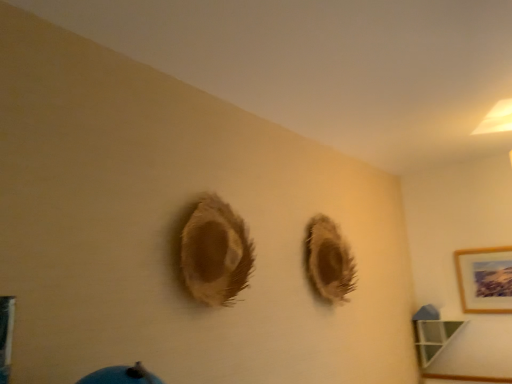
What do you see at coordinates (329, 261) in the screenshot? I see `fuzzy brown hole at center` at bounding box center [329, 261].

Find the location of a particular element. fuzzy brown hole at center is located at coordinates (329, 261).

What is the approximate height of wooden picture frame at upper right?

wooden picture frame at upper right is 17.20 inches in height.

Where is `fuzzy brown hole at center`? fuzzy brown hole at center is located at coordinates (329, 261).

From the image's perspective, between green glass shelf at lower right and fuzzy brown hole at center, which one is located above?

fuzzy brown hole at center.

From the picture: Which is more to the left, green glass shelf at lower right or fuzzy brown hole at center?

fuzzy brown hole at center.

How different are the orientations of green glass shelf at lower right and fuzzy brown hole at center in degrees?

The facing directions of green glass shelf at lower right and fuzzy brown hole at center are 87.4 degrees apart.

Is green glass shelf at lower right oriented towards fuzzy brown hole at center?

Yes, green glass shelf at lower right is facing fuzzy brown hole at center.

From the image's perspective, who appears lower, fuzzy brown hole at center or green glass shelf at lower right?

green glass shelf at lower right appears lower in the image.

Is fuzzy brown hole at center taller or shorter than green glass shelf at lower right?

In the image, fuzzy brown hole at center appears to be taller than green glass shelf at lower right.

Which is correct: fuzzy brown hole at center is inside green glass shelf at lower right, or outside of it?

fuzzy brown hole at center is outside green glass shelf at lower right.

From a real-world perspective, who is located higher, fuzzy brown hole at center or green glass shelf at lower right?

fuzzy brown hole at center.

Is green glass shelf at lower right facing towards wooden picture frame at upper right?

No, green glass shelf at lower right is not oriented towards wooden picture frame at upper right.

The height and width of the screenshot is (384, 512). I want to click on shelf behind the wooden picture frame at upper right, so click(x=433, y=338).

Is green glass shelf at lower right thinner than wooden picture frame at upper right?

Incorrect, the width of green glass shelf at lower right is not less than that of wooden picture frame at upper right.

Who is taller, green glass shelf at lower right or wooden picture frame at upper right?

wooden picture frame at upper right.

Where is `picture frame above the green glass shelf at lower right (from the image's perspective)`? This screenshot has width=512, height=384. picture frame above the green glass shelf at lower right (from the image's perspective) is located at coordinates (485, 280).

From a real-world perspective, relative to green glass shelf at lower right, is wooden picture frame at upper right vertically above or below?

wooden picture frame at upper right is situated higher than green glass shelf at lower right in the real world.

Which object is further away from the camera, wooden picture frame at upper right or green glass shelf at lower right?

Positioned behind is green glass shelf at lower right.

From the image's perspective, who appears lower, wooden picture frame at upper right or green glass shelf at lower right?

green glass shelf at lower right, from the image's perspective.

Is wooden picture frame at upper right not within fuzzy brown hole at center?

That's correct, wooden picture frame at upper right is outside of fuzzy brown hole at center.

From a real-world perspective, is wooden picture frame at upper right located beneath fuzzy brown hole at center?

Correct, in the physical world, wooden picture frame at upper right is lower than fuzzy brown hole at center.

Is wooden picture frame at upper right oriented towards fuzzy brown hole at center?

Yes, wooden picture frame at upper right is aimed at fuzzy brown hole at center.

What's the angular difference between wooden picture frame at upper right and fuzzy brown hole at center's facing directions?

They differ by 90 degrees in their facing directions.

Based on the photo, considering their positions, is fuzzy brown hole at center located in front of or behind wooden picture frame at upper right?

fuzzy brown hole at center is positioned closer to the viewer than wooden picture frame at upper right.

Is fuzzy brown hole at center located outside wooden picture frame at upper right?

Yes, fuzzy brown hole at center is outside of wooden picture frame at upper right.

From a real-world perspective, is fuzzy brown hole at center below wooden picture frame at upper right?

No, from a real-world perspective, fuzzy brown hole at center is not under wooden picture frame at upper right.

In order to click on picture frame below the fuzzy brown hole at center (from a real-world perspective) in this screenshot , I will do `click(485, 280)`.

Where is `shelf behind the fuzzy brown hole at center`? The width and height of the screenshot is (512, 384). shelf behind the fuzzy brown hole at center is located at coordinates (433, 338).

Locate an element on the screen. hole above the green glass shelf at lower right (from the image's perspective) is located at coordinates (329, 261).

From the image, which object appears to be farther from wooden picture frame at upper right, green glass shelf at lower right or fuzzy brown hole at center?

Based on the image, fuzzy brown hole at center appears to be further to wooden picture frame at upper right.

Estimate the real-world distances between objects in this image. Which object is closer to fuzzy brown hole at center, green glass shelf at lower right or wooden picture frame at upper right?

green glass shelf at lower right lies closer to fuzzy brown hole at center than the other object.

Considering their positions, is wooden picture frame at upper right positioned further to green glass shelf at lower right than fuzzy brown hole at center?

fuzzy brown hole at center lies further to green glass shelf at lower right than the other object.

Based on their spatial positions, is fuzzy brown hole at center or green glass shelf at lower right closer to wooden picture frame at upper right?

green glass shelf at lower right.

Considering their positions, is wooden picture frame at upper right positioned further to fuzzy brown hole at center than green glass shelf at lower right?

Among the two, wooden picture frame at upper right is located further to fuzzy brown hole at center.

From the image, which object appears to be farther from green glass shelf at lower right, fuzzy brown hole at center or wooden picture frame at upper right?

fuzzy brown hole at center.

The width and height of the screenshot is (512, 384). I want to click on shelf between fuzzy brown hole at center and wooden picture frame at upper right, so click(433, 338).